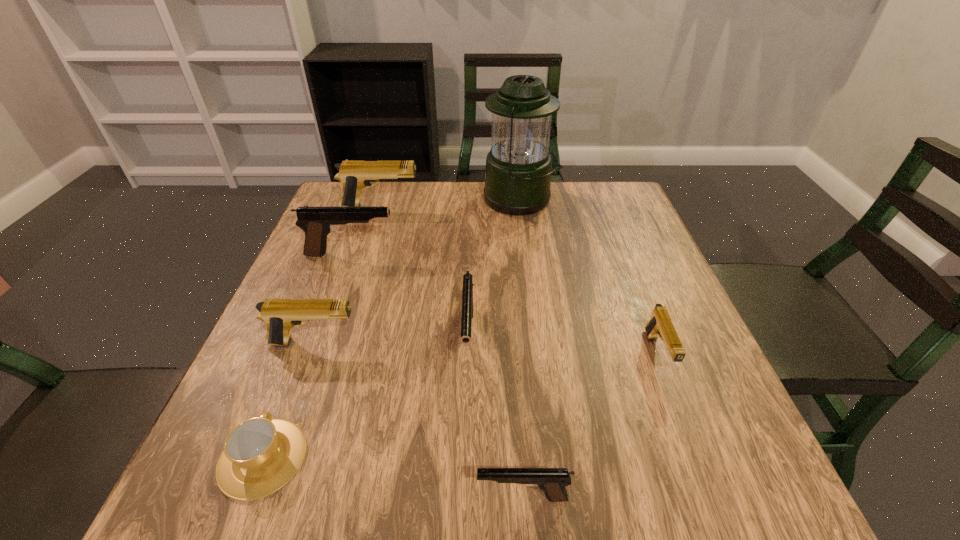
Select which object appears as the fifth closest to the second biggest tan pistol. Please provide its 2D coordinates. Your answer should be formatted as a tuple, i.e. [(x, y)], where the tuple contains the x and y coordinates of a point satisfying the conditions above.

[(354, 175)]

Choose which object is the second nearest neighbor to the brown cup. Please provide its 2D coordinates. Your answer should be formatted as a tuple, i.e. [(x, y)], where the tuple contains the x and y coordinates of a point satisfying the conditions above.

[(467, 292)]

Identify the location of pistol identified as the third closest to the cup. The height and width of the screenshot is (540, 960). (552, 481).

Locate which pistol ranks fourth in proximity to the fourth pistol from left to right. Please provide its 2D coordinates. Your answer should be formatted as a tuple, i.e. [(x, y)], where the tuple contains the x and y coordinates of a point satisfying the conditions above.

[(660, 325)]

Identify which tan pistol is the second nearest to the second smallest tan pistol. Please provide its 2D coordinates. Your answer should be formatted as a tuple, i.e. [(x, y)], where the tuple contains the x and y coordinates of a point satisfying the conditions above.

[(660, 325)]

Locate which tan pistol is the closest to the rightmost tan pistol. Please provide its 2D coordinates. Your answer should be formatted as a tuple, i.e. [(x, y)], where the tuple contains the x and y coordinates of a point satisfying the conditions above.

[(280, 315)]

Locate an element on the screen. black pistol identified as the second closest to the sixth nearest object is located at coordinates (552, 481).

You are a GUI agent. You are given a task and a screenshot of the screen. Output one action in this format:
    pyautogui.click(x=<x>, y=<y>)
    Task: Click on the black pistol that is the closest to the brown cup
    This screenshot has width=960, height=540.
    Given the screenshot: What is the action you would take?
    pyautogui.click(x=467, y=292)